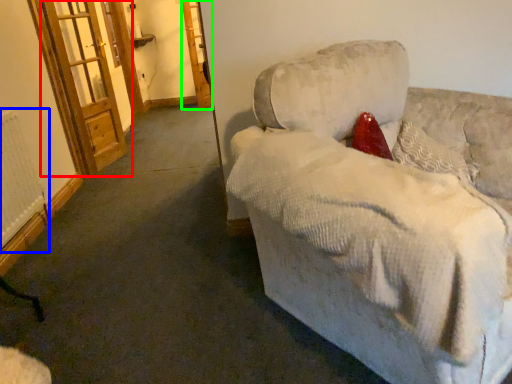
Question: Which is farther away from screen door (highlighted by a red box)? radiator (highlighted by a blue box) or screen door (highlighted by a green box)?

Choices:
 (A) radiator
 (B) screen door

Answer: (B)